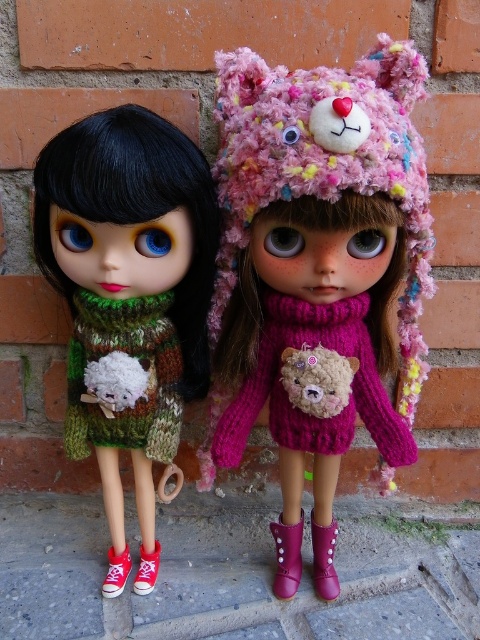
Question: Which of the following is the closest to the observer?

Choices:
 (A) pink knitted sweater at center
 (B) fluffy brown bear at center

Answer: (A)

Question: Is fuzzy pink hat at center to the left of green knitted sweater at left from the viewer's perspective?

Choices:
 (A) yes
 (B) no

Answer: (B)

Question: Which point is closer to the camera?

Choices:
 (A) (50, 227)
 (B) (308, 422)

Answer: (A)

Question: Which object is the closest to the fuzzy pink hat at center?

Choices:
 (A) pink knitted sweater at center
 (B) green knitted sweater at left
 (C) fluffy brown bear at center

Answer: (A)

Question: Can you confirm if pink knitted sweater at center is positioned to the right of fluffy brown bear at center?

Choices:
 (A) yes
 (B) no

Answer: (A)

Question: Is green knitted sweater at left above fluffy brown bear at center?

Choices:
 (A) no
 (B) yes

Answer: (B)